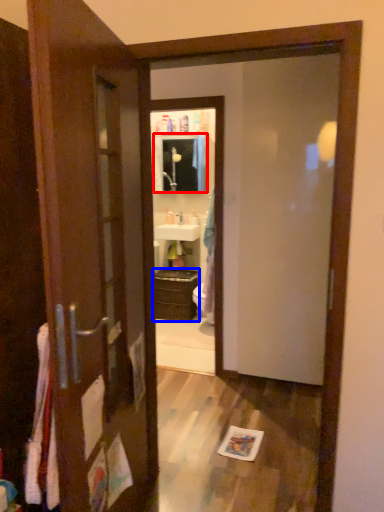
Question: Which object appears farthest to the camera in this image, medicine cabinet (highlighted by a red box) or cabinetry (highlighted by a blue box)?

Choices:
 (A) medicine cabinet
 (B) cabinetry

Answer: (A)